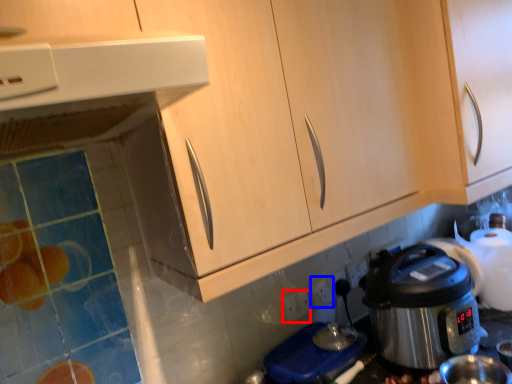
Question: Which object is closer to the camera taking this photo, power outlet (highlighted by a red box) or electric outlet (highlighted by a blue box)?

Choices:
 (A) power outlet
 (B) electric outlet

Answer: (A)